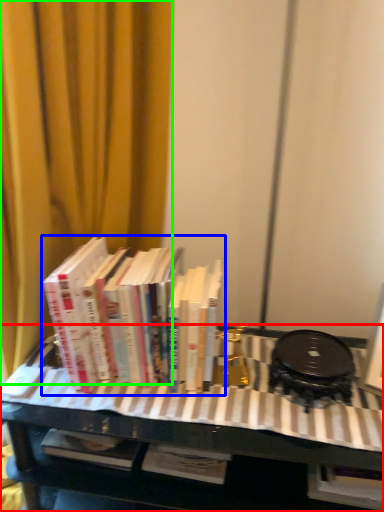
Question: Based on their relative distances, which object is farther from table (highlighted by a red box)? Choose from book (highlighted by a blue box) and curtain (highlighted by a green box).

Choices:
 (A) book
 (B) curtain

Answer: (B)